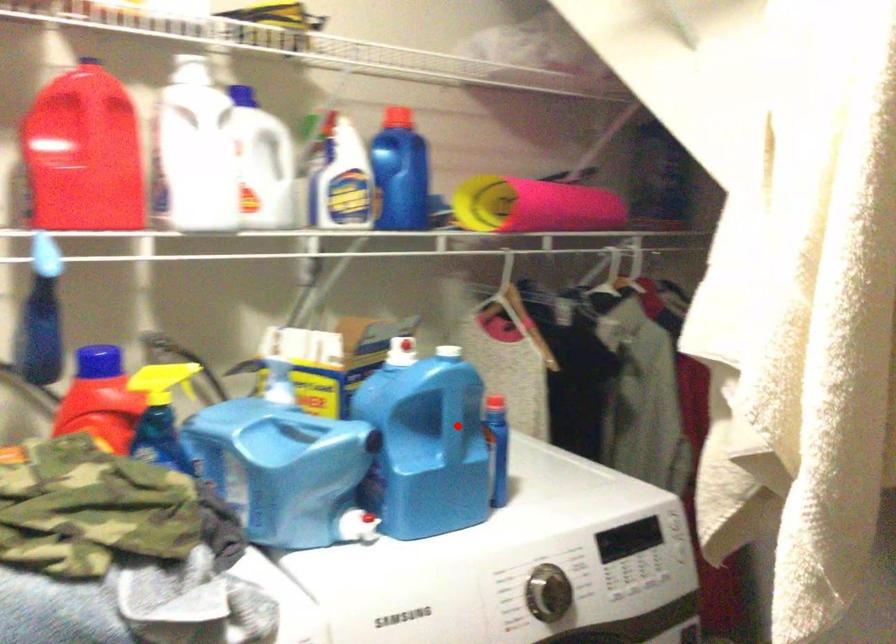
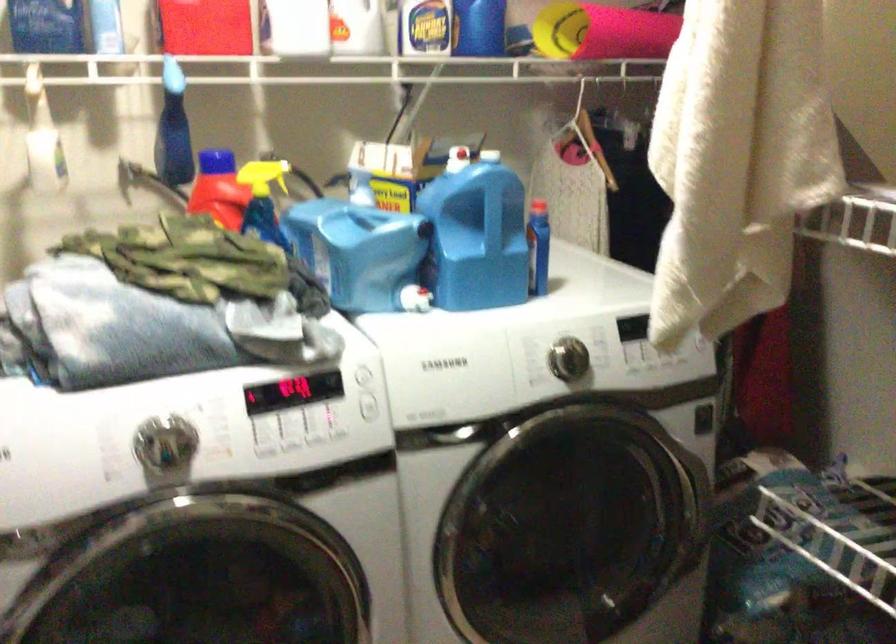
The point at the highlighted location is marked in the first image. Where is the corresponding point in the second image?

(496, 219)